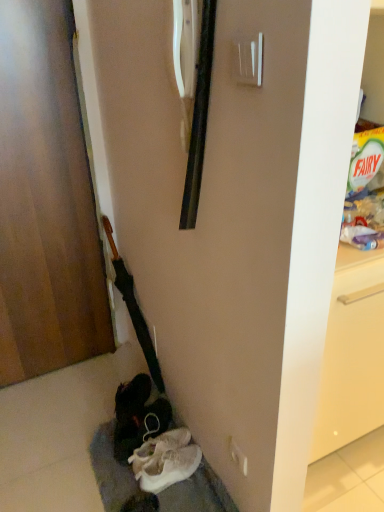
Question: Considering the positions of white fabric shoe at lower center, positioned as the first footwear in back-to-front order, and white suede sneakers at lower center, which is counted as the second footwear, starting from the back, in the image, is white fabric shoe at lower center, positioned as the first footwear in back-to-front order, wider or thinner than white suede sneakers at lower center, which is counted as the second footwear, starting from the back,?

Choices:
 (A) thin
 (B) wide

Answer: (B)

Question: From a real-world perspective, is white fabric shoe at lower center, positioned as the first footwear in back-to-front order, physically located above or below white suede sneakers at lower center, which is counted as the second footwear, starting from the back?

Choices:
 (A) above
 (B) below

Answer: (A)

Question: Based on their relative distances, which object is nearer to the wooden door at left?

Choices:
 (A) white suede sneakers at lower center, which is counted as the second footwear, starting from the back
 (B) white fabric shoe at lower center, positioned as the first footwear in back-to-front order
 (C) white plastic door handle at upper center

Answer: (B)

Question: Which object is positioned farthest from the wooden door at left?

Choices:
 (A) white plastic door handle at upper center
 (B) white fabric shoe at lower center, which is counted as the second footwear, starting from the front
 (C) white suede sneakers at lower center, the first footwear when ordered from front to back

Answer: (A)